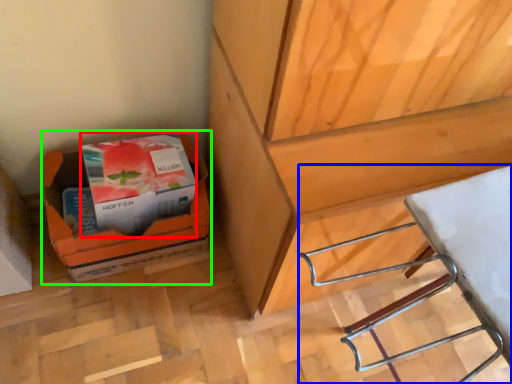
Question: Which is nearer to the paperback book (highlighted by a red box)? wood (highlighted by a blue box) or cardboard box (highlighted by a green box).

Choices:
 (A) wood
 (B) cardboard box

Answer: (B)